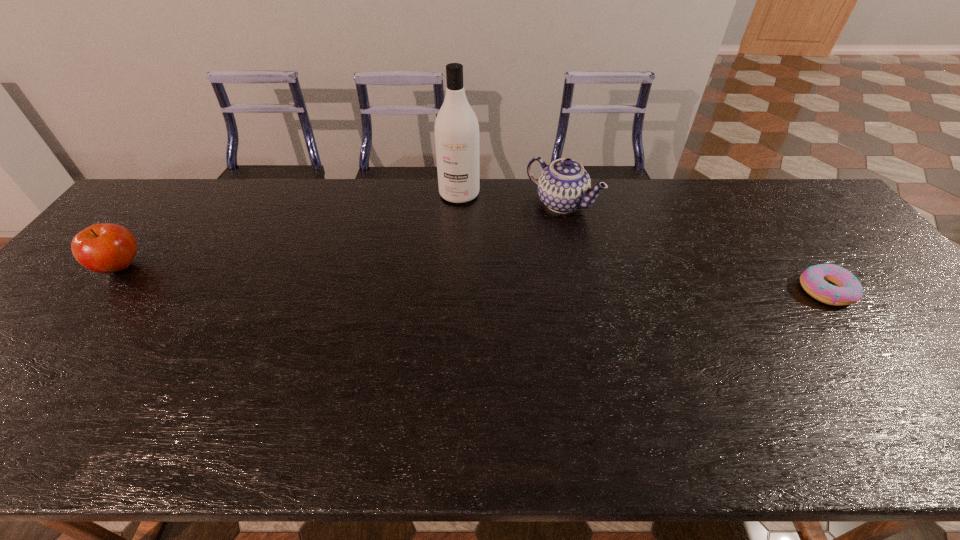
Locate an element on the screen. The width and height of the screenshot is (960, 540). free space between the apple and the chinaware is located at coordinates (341, 235).

Locate an element on the screen. vacant point located between the tallest object and the third tallest object is located at coordinates (290, 231).

This screenshot has width=960, height=540. Find the location of `free space between the shortest object and the third tallest object`. free space between the shortest object and the third tallest object is located at coordinates (473, 279).

Image resolution: width=960 pixels, height=540 pixels. Find the location of `object that is the second nearest to the doughnut`. object that is the second nearest to the doughnut is located at coordinates (456, 128).

Where is `object that can be found as the second closest to the apple`? This screenshot has height=540, width=960. object that can be found as the second closest to the apple is located at coordinates (563, 186).

You are a GUI agent. You are given a task and a screenshot of the screen. Output one action in this format:
    pyautogui.click(x=<x>, y=<y>)
    Task: Click on the free point that satisfies the following two spatial constraints: 1. on the front side of the rightmost object; 2. on the right side of the third tallest object
    
    Given the screenshot: What is the action you would take?
    pyautogui.click(x=102, y=291)